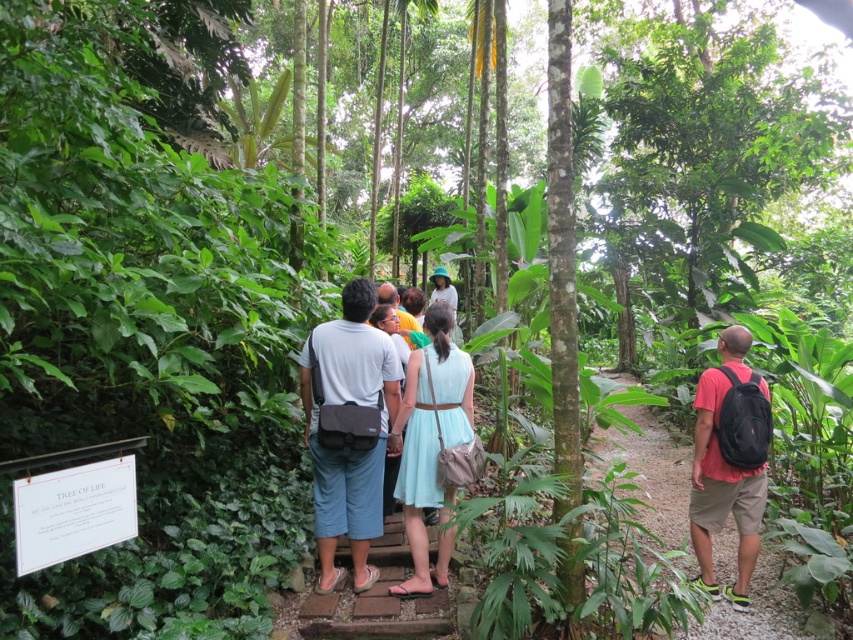
You are a hiker carrying a matte black backpack at right and a red backpack at right. You want to check the contents of both backpacks. Which backpack will you need to adjust first to access the one behind it?

The matte black backpack at right is in front of the red backpack at right, so you will need to adjust the matte black backpack at right first to access the red backpack at right.

You are a hiker carrying a red backpack at right and want to reach the signboard on the left side. The path is narrow and only allows one person at a time. If your friend is standing exactly halfway between you and the signboard, how far apart are you and your friend in feet?

The distance between you and the signboard is 29.65 feet. Your friend is halfway, so the distance between you and your friend is half of 29.65, which is 14.825 feet.

From the picture: You are a photographer trying to capture the entire path in the tropical forest. You are standing at the starting point of the path. Which point, point 1 at coordinate (654, 531) or point 2 at coordinate (450, 348), is closer to your camera to ensure the entire path is in focus?

Point 2 at coordinate (450, 348) is closer to the camera, so focusing on it will help capture the entire path in focus since it is nearer than point 1 at coordinate (654, 531).